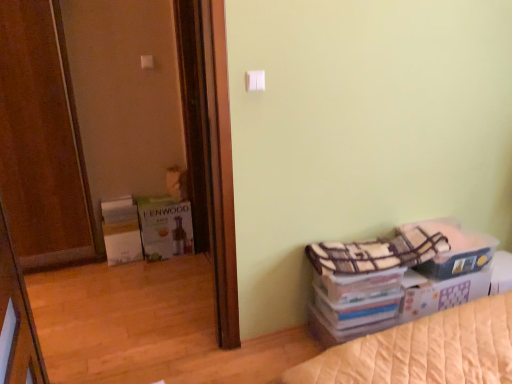
What do you see at coordinates (147, 62) in the screenshot?
I see `white plastic light switch at upper center, which is the 2th light switch in front-to-back order` at bounding box center [147, 62].

Locate an element on the screen. brown wooden screen door at left is located at coordinates (220, 170).

The image size is (512, 384). I want to click on plaid fabric storage box at lower right, so click(x=454, y=249).

Which is in front, white plastic light switch at upper center, which ranks as the 2th light switch in right-to-left order, or brown wooden screen door at left?

brown wooden screen door at left.

Which of these two, white plastic light switch at upper center, which appears as the first light switch when viewed from the left, or brown wooden screen door at left, stands taller?

Standing taller between the two is brown wooden screen door at left.

Is white plastic light switch at upper center, which appears as the first light switch when viewed from the left, oriented away from brown wooden screen door at left?

No.

Is white plastic light switch at upper center, which is the 2th light switch in front-to-back order, located outside brown wooden screen door at left?

Yes, white plastic light switch at upper center, which is the 2th light switch in front-to-back order, is not within brown wooden screen door at left.

Based on their sizes in the image, would you say white plastic light switch at upper center, acting as the 1th light switch starting from the right, is bigger or smaller than white plastic light switch at upper center, which ranks as the 2th light switch in right-to-left order?

Considering their sizes, white plastic light switch at upper center, acting as the 1th light switch starting from the right, takes up less space than white plastic light switch at upper center, which ranks as the 2th light switch in right-to-left order.

Is the surface of white plastic light switch at upper center, positioned as the second light switch in top-to-bottom order, in direct contact with white plastic light switch at upper center, which appears as the first light switch when viewed from the left?

No, white plastic light switch at upper center, positioned as the second light switch in top-to-bottom order, is not beside white plastic light switch at upper center, which appears as the first light switch when viewed from the left.

From the image's perspective, is white plastic light switch at upper center, the first light switch viewed from the front, located beneath white plastic light switch at upper center, which is the 2th light switch in front-to-back order?

Yes.

Between point (253, 82) and point (144, 63), which one is positioned in front?

Point (253, 82)

What's the angular difference between white plastic light switch at upper center, which is the 2th light switch in front-to-back order, and wooden door at left's facing directions?

The angle between the facing direction of white plastic light switch at upper center, which is the 2th light switch in front-to-back order, and the facing direction of wooden door at left is 109 degrees.

Which is nearer, (148, 55) or (5, 127)?

The point (5, 127) is more forward.

From the image's perspective, which light switch is the 2nd one above the wooden door at left? Please provide its 2D coordinates.

[(147, 62)]

From the picture: Is white plastic light switch at upper center, which is the 2th light switch in front-to-back order, touching wooden door at left?

white plastic light switch at upper center, which is the 2th light switch in front-to-back order, is not next to wooden door at left, and they're not touching.

Considering the points (48, 58) and (152, 57), which point is in front, point (48, 58) or point (152, 57)?

Point (48, 58)

Could you tell me if wooden door at left is facing white plastic light switch at upper center, which ranks as the 2th light switch in right-to-left order?

No, wooden door at left is not oriented towards white plastic light switch at upper center, which ranks as the 2th light switch in right-to-left order.

From a real-world perspective, is wooden door at left below white plastic light switch at upper center, the first light switch viewed from the top?

Yes, from a real-world perspective, wooden door at left is under white plastic light switch at upper center, the first light switch viewed from the top.

From the image's perspective, is wooden door at left under white plastic light switch at upper center, which ranks as the 2th light switch in right-to-left order?

Yes, from the image's perspective, wooden door at left is below white plastic light switch at upper center, which ranks as the 2th light switch in right-to-left order.

Find the location of `light switch located on the right of wooden door at left`. light switch located on the right of wooden door at left is located at coordinates (255, 80).

Do you think wooden door at left is within white plastic light switch at upper center, positioned as the second light switch in left-to-right order, or outside of it?

The correct answer is: outside.

How many degrees apart are the facing directions of wooden door at left and white plastic light switch at upper center, acting as the 1th light switch starting from the right?

There is a 109-degree angle between the facing directions of wooden door at left and white plastic light switch at upper center, acting as the 1th light switch starting from the right.

Considering the sizes of objects wooden door at left and white plastic light switch at upper center, positioned as the second light switch in left-to-right order, in the image provided, who is taller, wooden door at left or white plastic light switch at upper center, positioned as the second light switch in left-to-right order,?

With more height is wooden door at left.

How far apart are white plastic light switch at upper center, which ranks as the 2th light switch in bottom-to-top order, and plaid fabric storage box at lower right?

The distance of white plastic light switch at upper center, which ranks as the 2th light switch in bottom-to-top order, from plaid fabric storage box at lower right is 2.14 meters.

Is white plastic light switch at upper center, which ranks as the 2th light switch in bottom-to-top order, facing towards plaid fabric storage box at lower right?

No, white plastic light switch at upper center, which ranks as the 2th light switch in bottom-to-top order, does not turn towards plaid fabric storage box at lower right.

Based on the photo, which is closer to the camera, (x=152, y=61) or (x=437, y=276)?

Point (x=152, y=61) is farther from the camera than point (x=437, y=276).

Is white plastic light switch at upper center, positioned as the second light switch in left-to-right order, not within brown wooden screen door at left?

That's correct, white plastic light switch at upper center, positioned as the second light switch in left-to-right order, is outside of brown wooden screen door at left.

Considering the sizes of white plastic light switch at upper center, which is counted as the first light switch, starting from the bottom, and brown wooden screen door at left in the image, is white plastic light switch at upper center, which is counted as the first light switch, starting from the bottom, taller or shorter than brown wooden screen door at left?

white plastic light switch at upper center, which is counted as the first light switch, starting from the bottom, is shorter than brown wooden screen door at left.

Is white plastic light switch at upper center, positioned as the second light switch in left-to-right order, bigger or smaller than brown wooden screen door at left?

white plastic light switch at upper center, positioned as the second light switch in left-to-right order, is smaller than brown wooden screen door at left.

Locate an element on the screen. light switch behind the brown wooden screen door at left is located at coordinates (147, 62).

Identify the location of light switch that is above the white plastic light switch at upper center, the first light switch viewed from the front (from the image's perspective). The height and width of the screenshot is (384, 512). (147, 62).

Based on their spatial positions, is wooden door at left or white plastic light switch at upper center, which is the 2th light switch in front-to-back order, closer to plaid fabric storage box at lower right?

white plastic light switch at upper center, which is the 2th light switch in front-to-back order, is positioned closer to the anchor plaid fabric storage box at lower right.

Considering their positions, is white plastic light switch at upper center, positioned as the second light switch in left-to-right order, positioned further to brown wooden screen door at left than plaid fabric storage box at lower right?

plaid fabric storage box at lower right is further to brown wooden screen door at left.

Which object lies nearer to the anchor point plaid fabric storage box at lower right, brown wooden screen door at left or wooden door at left?

brown wooden screen door at left is closer to plaid fabric storage box at lower right.

From the image, which object appears to be farther from white plastic light switch at upper center, which is counted as the first light switch, starting from the bottom, brown wooden screen door at left or wooden door at left?

wooden door at left lies further to white plastic light switch at upper center, which is counted as the first light switch, starting from the bottom, than the other object.

Which object lies further to the anchor point wooden door at left, brown wooden screen door at left or plaid fabric storage box at lower right?

plaid fabric storage box at lower right.

When comparing their distances from white plastic light switch at upper center, which ranks as the 2th light switch in bottom-to-top order, does wooden door at left or brown wooden screen door at left seem closer?

wooden door at left is closer to white plastic light switch at upper center, which ranks as the 2th light switch in bottom-to-top order.

When comparing their distances from white plastic light switch at upper center, placed as the 2th light switch when sorted from back to front, does white plastic light switch at upper center, which is the 2th light switch in front-to-back order, or plaid fabric storage box at lower right seem closer?

plaid fabric storage box at lower right is positioned closer to the anchor white plastic light switch at upper center, placed as the 2th light switch when sorted from back to front.

From the image, which object appears to be farther from plaid fabric storage box at lower right, white plastic light switch at upper center, which is the 2th light switch in front-to-back order, or white plastic light switch at upper center, positioned as the second light switch in top-to-bottom order?

white plastic light switch at upper center, which is the 2th light switch in front-to-back order, lies further to plaid fabric storage box at lower right than the other object.

Image resolution: width=512 pixels, height=384 pixels. Find the location of `light switch between wooden door at left and brown wooden screen door at left in the front-back direction`. light switch between wooden door at left and brown wooden screen door at left in the front-back direction is located at coordinates (x=255, y=80).

Where is `screen door positioned between white plastic light switch at upper center, positioned as the second light switch in top-to-bottom order, and white plastic light switch at upper center, which is the first light switch in back-to-front order, from near to far`? screen door positioned between white plastic light switch at upper center, positioned as the second light switch in top-to-bottom order, and white plastic light switch at upper center, which is the first light switch in back-to-front order, from near to far is located at coordinates (220, 170).

Where is `storage box located between wooden door at left and white plastic light switch at upper center, which is the first light switch in back-to-front order, in the depth direction`? This screenshot has width=512, height=384. storage box located between wooden door at left and white plastic light switch at upper center, which is the first light switch in back-to-front order, in the depth direction is located at coordinates (454, 249).

Where is `screen door located between wooden door at left and white plastic light switch at upper center, which appears as the first light switch when viewed from the left, in the depth direction`? Image resolution: width=512 pixels, height=384 pixels. screen door located between wooden door at left and white plastic light switch at upper center, which appears as the first light switch when viewed from the left, in the depth direction is located at coordinates (220, 170).